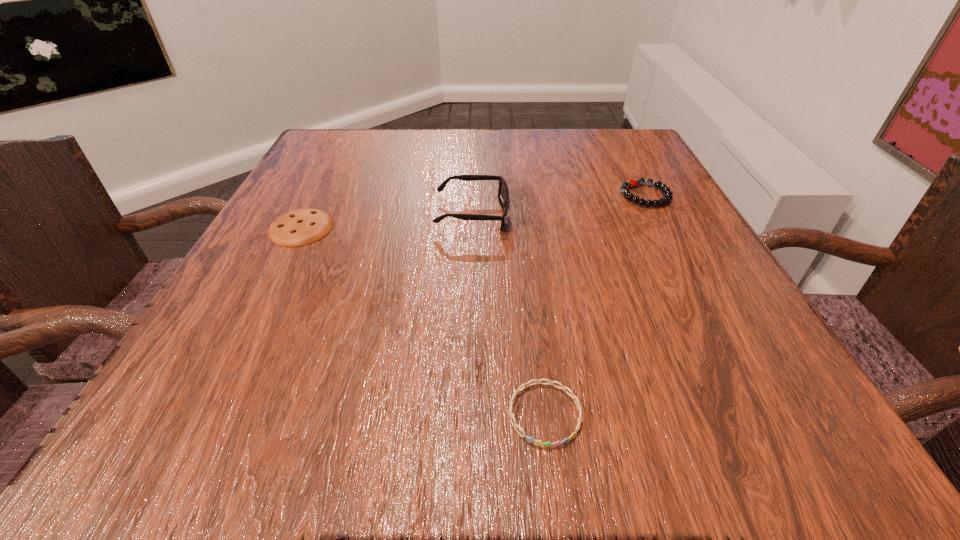
Where is `blank area in the image that satisfies the following two spatial constraints: 1. on the back side of the rightmost object; 2. on the left side of the cookie`? The height and width of the screenshot is (540, 960). blank area in the image that satisfies the following two spatial constraints: 1. on the back side of the rightmost object; 2. on the left side of the cookie is located at coordinates (318, 195).

The image size is (960, 540). Identify the location of free space that satisfies the following two spatial constraints: 1. on the front-facing side of the tallest object; 2. on the front side of the leftmost object. (472, 228).

Locate an element on the screen. vacant space that satisfies the following two spatial constraints: 1. on the back side of the third shortest object; 2. on the right side of the leftmost object is located at coordinates (318, 195).